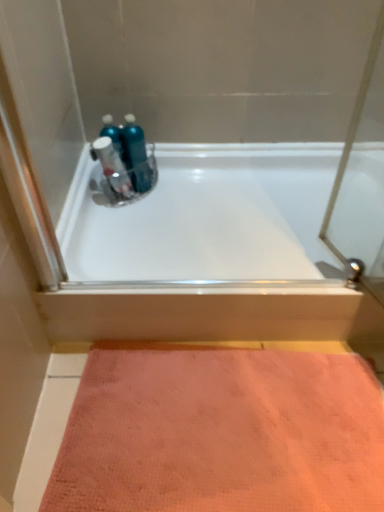
Question: From a real-world perspective, does metallic blue spray bottle at upper center sit lower than white glossy bathtub at upper center?

Choices:
 (A) no
 (B) yes

Answer: (A)

Question: From the image's perspective, is metallic blue spray bottle at upper center above white glossy bathtub at upper center?

Choices:
 (A) no
 (B) yes

Answer: (B)

Question: Is the position of metallic blue spray bottle at upper center less distant than that of white glossy bathtub at upper center?

Choices:
 (A) no
 (B) yes

Answer: (A)

Question: Is metallic blue spray bottle at upper center beside white glossy bathtub at upper center?

Choices:
 (A) yes
 (B) no

Answer: (B)

Question: Is metallic blue spray bottle at upper center bigger than white glossy bathtub at upper center?

Choices:
 (A) no
 (B) yes

Answer: (A)

Question: From the image's perspective, is metallic blue spray bottle at upper center beneath white glossy bathtub at upper center?

Choices:
 (A) no
 (B) yes

Answer: (A)

Question: Can you confirm if white glossy bathtub at upper center is thinner than pink textured mat at lower center?

Choices:
 (A) yes
 (B) no

Answer: (B)

Question: From the image's perspective, is white glossy bathtub at upper center over pink textured mat at lower center?

Choices:
 (A) no
 (B) yes

Answer: (B)

Question: Does white glossy bathtub at upper center lie in front of pink textured mat at lower center?

Choices:
 (A) no
 (B) yes

Answer: (A)

Question: Is white glossy bathtub at upper center at the right side of pink textured mat at lower center?

Choices:
 (A) yes
 (B) no

Answer: (A)

Question: Is white glossy bathtub at upper center bigger than pink textured mat at lower center?

Choices:
 (A) no
 (B) yes

Answer: (B)

Question: Considering the relative sizes of white glossy bathtub at upper center and pink textured mat at lower center in the image provided, is white glossy bathtub at upper center taller than pink textured mat at lower center?

Choices:
 (A) no
 (B) yes

Answer: (B)

Question: Considering the relative sizes of blue glossy mouthwash at center and white glossy bathtub at upper center in the image provided, is blue glossy mouthwash at center wider than white glossy bathtub at upper center?

Choices:
 (A) no
 (B) yes

Answer: (A)